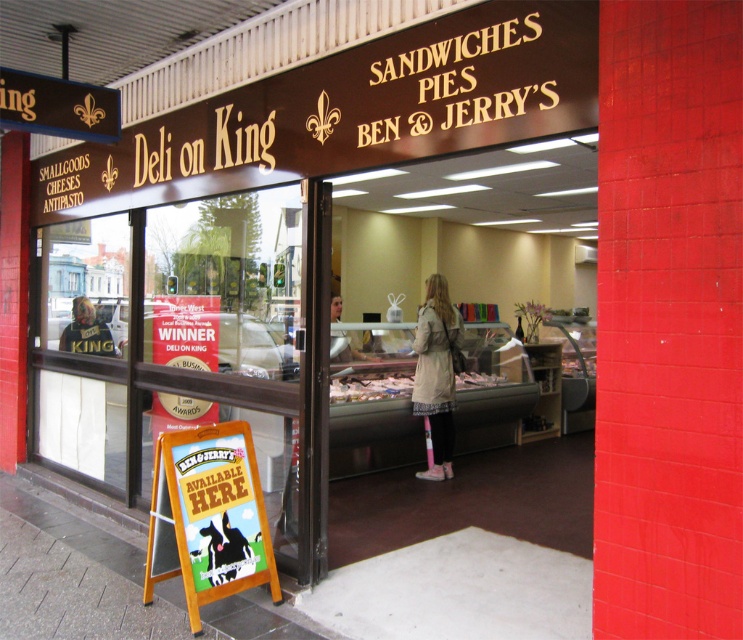
Question: Which object is farther from the camera taking this photo?

Choices:
 (A) light beige trench coat at center
 (B) wooden signboard at lower left

Answer: (A)

Question: Does wooden signboard at lower left appear over light beige trench coat at center?

Choices:
 (A) yes
 (B) no

Answer: (B)

Question: Does wooden signboard at lower left have a greater width compared to light beige trench coat at center?

Choices:
 (A) yes
 (B) no

Answer: (A)

Question: Among these points, which one is nearest to the camera?

Choices:
 (A) (424, 308)
 (B) (212, 531)

Answer: (B)

Question: Is wooden signboard at lower left below light beige trench coat at center?

Choices:
 (A) yes
 (B) no

Answer: (A)

Question: Which object is farther from the camera taking this photo?

Choices:
 (A) wooden signboard at lower left
 (B) light beige trench coat at center

Answer: (B)